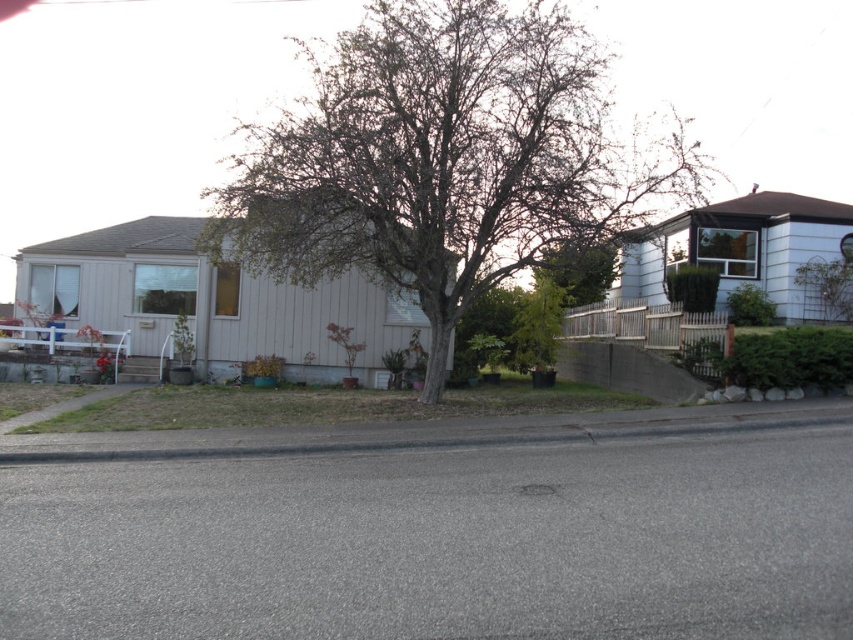
Question: Can you confirm if bare wood tree at center is positioned below green leafy tree at center?

Choices:
 (A) yes
 (B) no

Answer: (B)

Question: Is bare wood tree at center to the right of green leafy tree at center from the viewer's perspective?

Choices:
 (A) no
 (B) yes

Answer: (A)

Question: Among these objects, which one is nearest to the camera?

Choices:
 (A) green leafy tree at center
 (B) bare wood tree at center

Answer: (B)

Question: Among these objects, which one is farthest from the camera?

Choices:
 (A) green leafy tree at center
 (B) bare wood tree at center

Answer: (A)

Question: Which object is closer to the camera taking this photo?

Choices:
 (A) bare wood tree at center
 (B) green leafy tree at center

Answer: (A)

Question: Can you confirm if bare wood tree at center is positioned below green leafy tree at center?

Choices:
 (A) yes
 (B) no

Answer: (B)